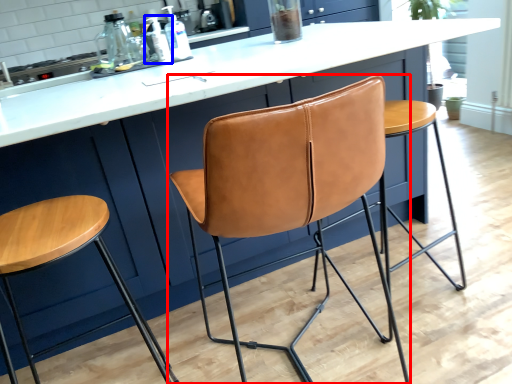
Question: Among these objects, which one is farthest to the camera, chair (highlighted by a red box) or bottle (highlighted by a blue box)?

Choices:
 (A) chair
 (B) bottle

Answer: (B)